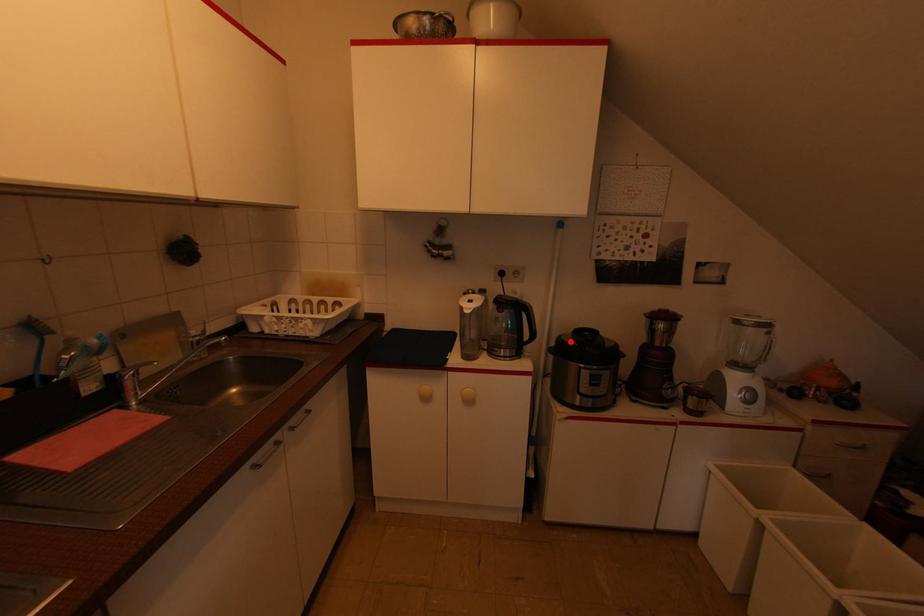
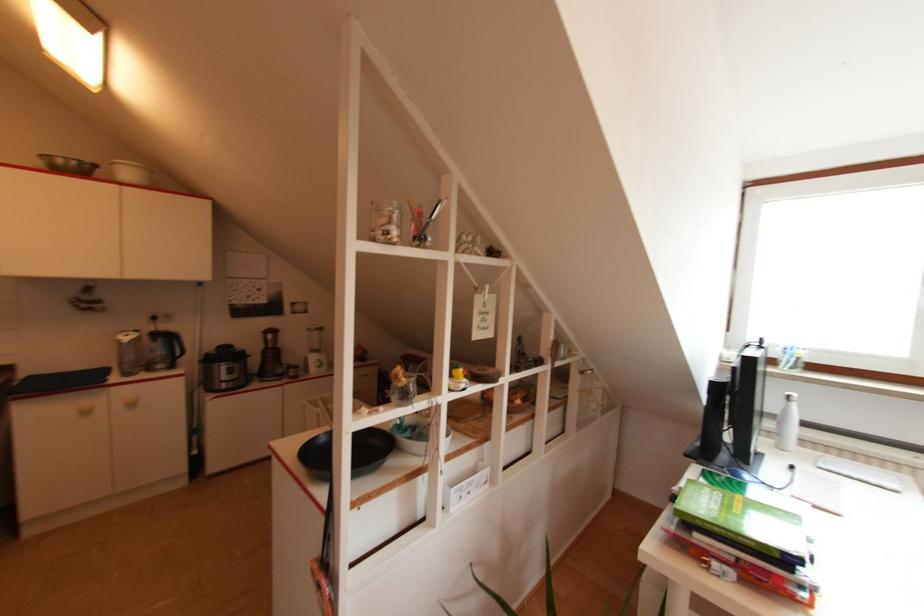
The point at the highlighted location is marked in the first image. Where is the corresponding point in the second image?

(213, 353)